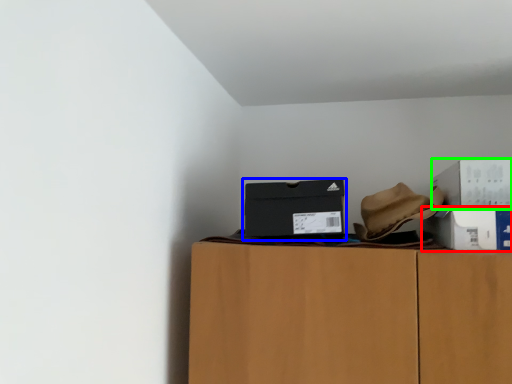
Question: Based on their relative distances, which object is nearer to box (highlighted by a red box)? Choose from box (highlighted by a blue box) and box (highlighted by a green box).

Choices:
 (A) box
 (B) box

Answer: (B)